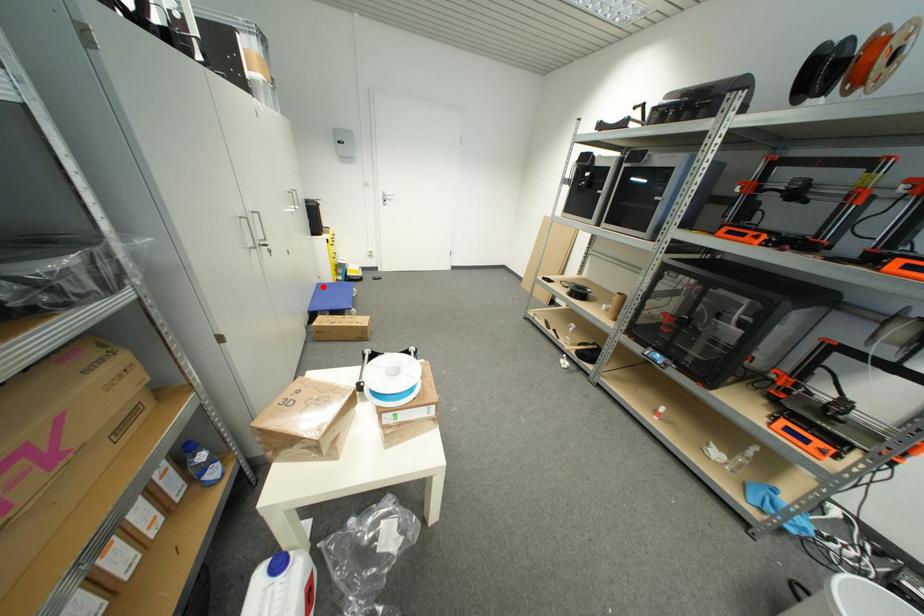
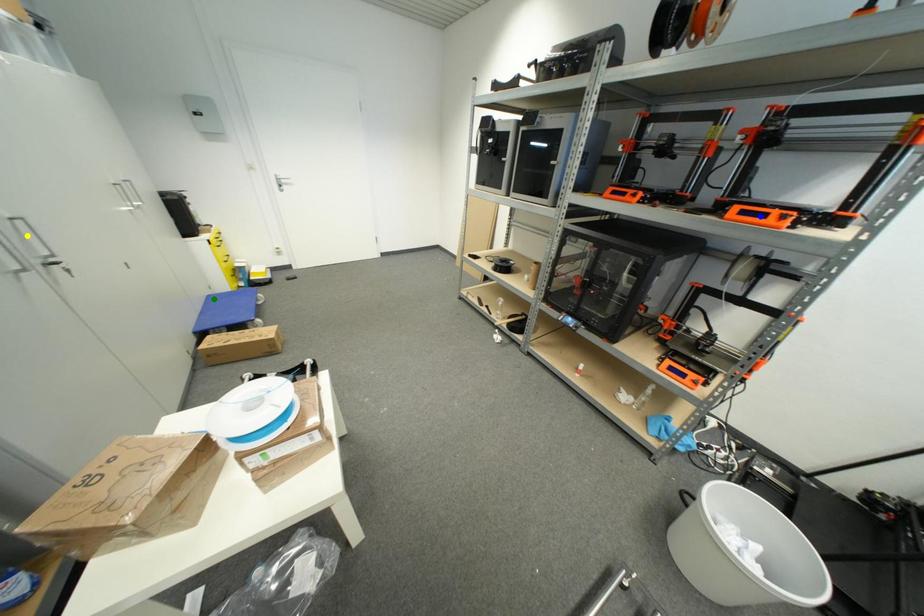
Question: I am providing you with two images of the same scene from different viewpoints. A red point is marked on the first image. You are given multiple points on the second image. Which mark in image 2 goes with the point in image 1?

Choices:
 (A) blue point
 (B) yellow point
 (C) green point

Answer: (C)